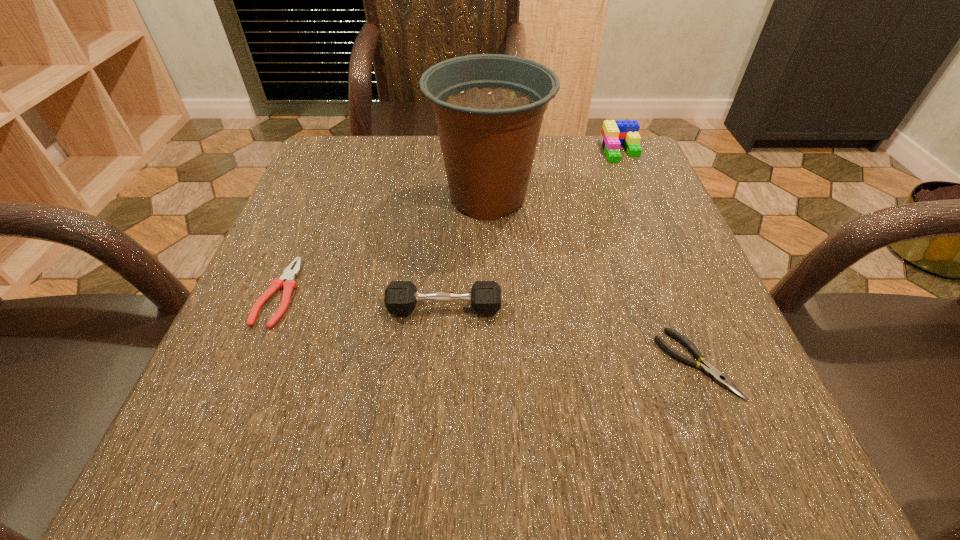
This screenshot has width=960, height=540. Find the location of `free location that satisfies the following two spatial constraints: 1. on the front side of the nearer pliers; 2. on the left side of the flowerpot`. free location that satisfies the following two spatial constraints: 1. on the front side of the nearer pliers; 2. on the left side of the flowerpot is located at coordinates (492, 364).